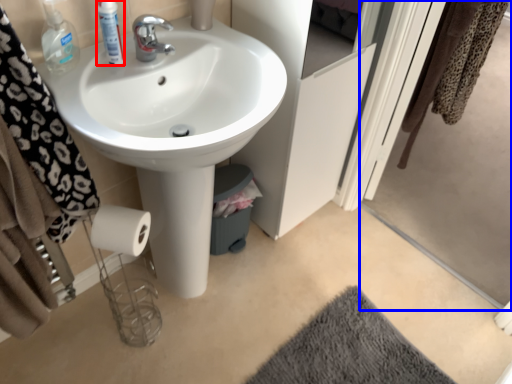
Question: Which point is further to the camera, mouthwash (highlighted by a red box) or screen door (highlighted by a blue box)?

Choices:
 (A) mouthwash
 (B) screen door

Answer: (A)